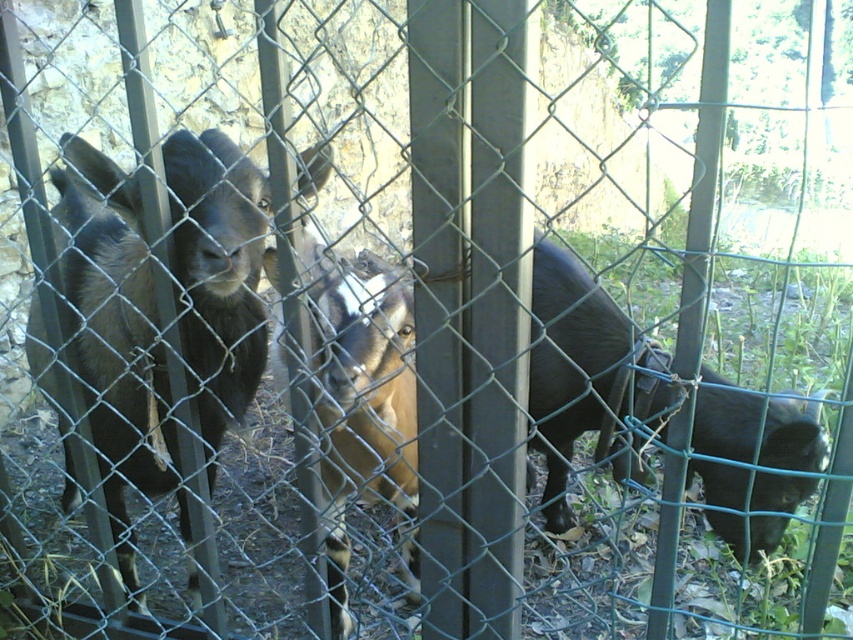
You are a farmer checking the goats in the fenced enclosure. You see the dark brown fur goat at left and the brown fuzzy goat at center. Which goat is closer to you?

The dark brown fur goat at left is closer to you because it is positioned further to the viewer than the brown fuzzy goat at center.

You are standing at the center of the enclosure looking towards the stone wall in the background. Which direction should you move to reach the dark brown fur goat at left?

Since the dark brown fur goat at left is located at coordinate point 0.531 on the x axis and 0.137 on the y axis, you should move to the left and slightly forward to reach it from the center of the enclosure.